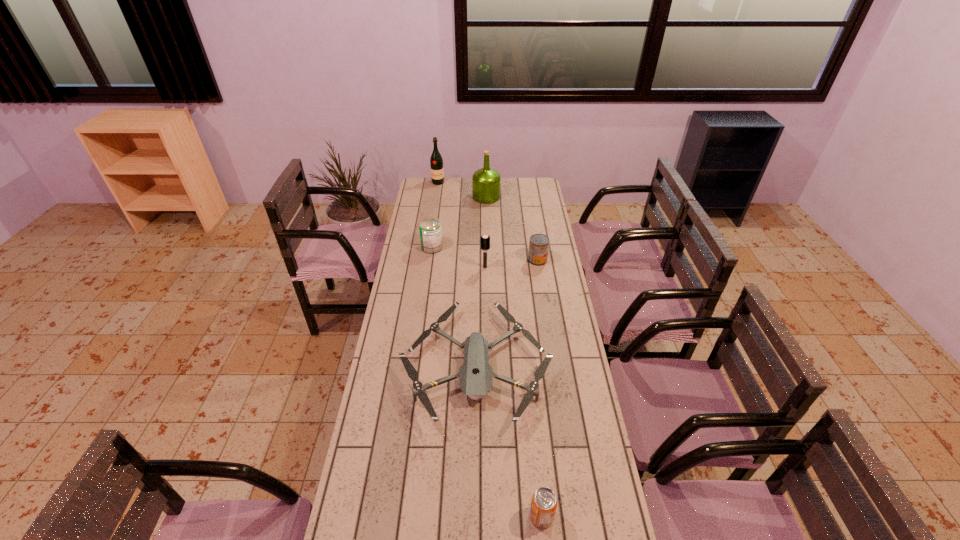
The width and height of the screenshot is (960, 540). I want to click on drone that is at the left edge, so [x=476, y=375].

Image resolution: width=960 pixels, height=540 pixels. Identify the location of can at the right edge. (539, 243).

I want to click on drone that is at the right edge, so click(476, 375).

Locate an element on the screen. object located at the far left corner is located at coordinates click(436, 162).

Where is `vacant area at the far edge`? The image size is (960, 540). vacant area at the far edge is located at coordinates (450, 193).

This screenshot has height=540, width=960. In order to click on vacant space at the left edge of the desktop in this screenshot , I will do `click(436, 200)`.

Identify the location of vacant space at the right edge. The image size is (960, 540). (537, 349).

In the image, there is a desktop. In order to click on free space at the far right corner in this screenshot , I will do `click(522, 185)`.

I want to click on vacant space that's between the left can and the third tallest object, so click(x=459, y=257).

Where is `free point between the soda can and the hairbrush`? The image size is (960, 540). free point between the soda can and the hairbrush is located at coordinates (514, 392).